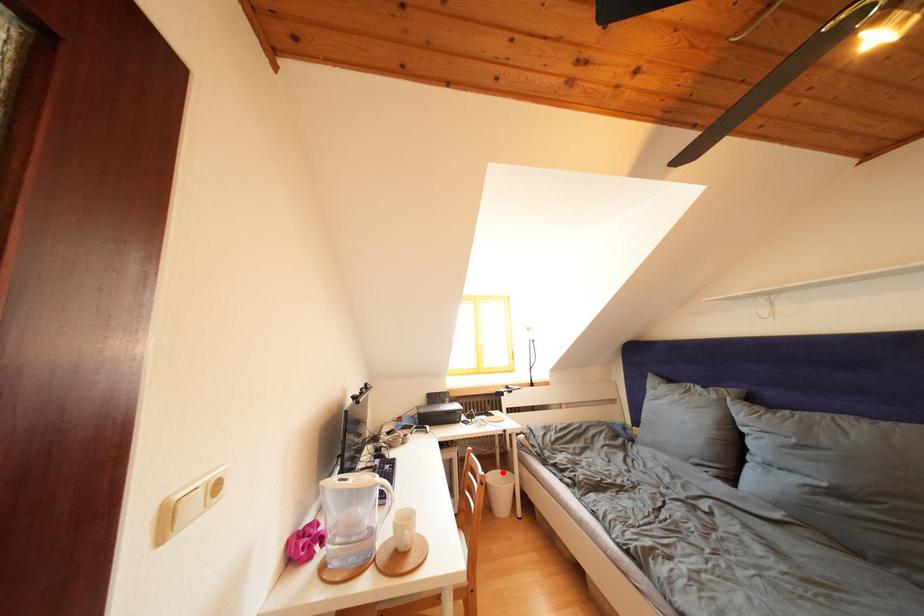
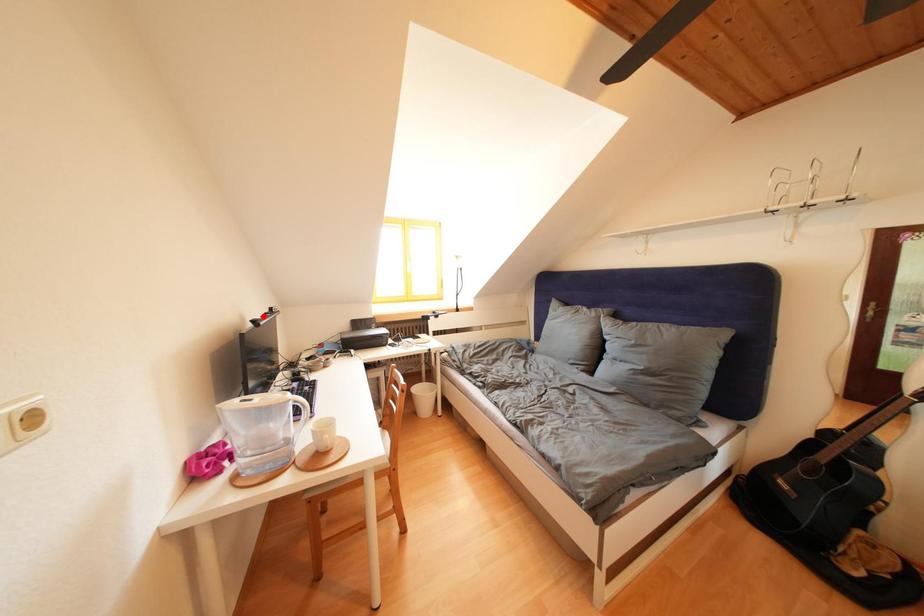
I am providing you with two images of the same scene from different viewpoints. A red point is marked on the first image and another point is marked on the second image. Do the highlighted points in image1 and image2 indicate the same real-world spot?

No